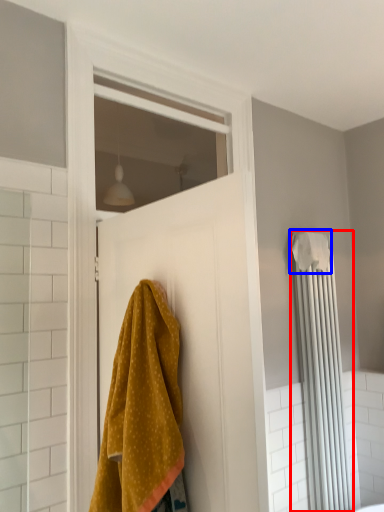
Question: Which object appears farthest to the camera in this image, shower curtain (highlighted by a red box) or bath towel (highlighted by a blue box)?

Choices:
 (A) shower curtain
 (B) bath towel

Answer: (B)